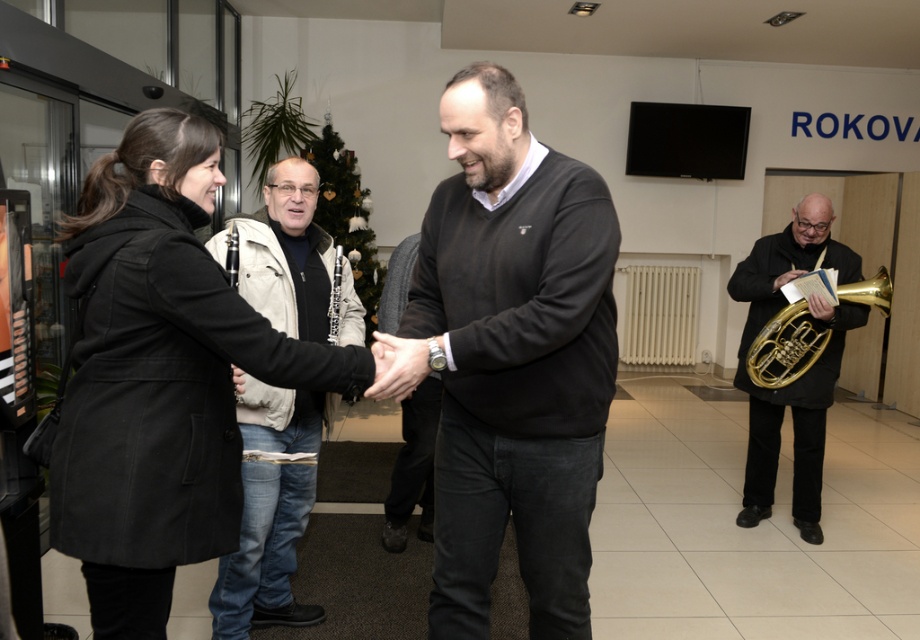
You are an interior designer assessing the layout of this music store. You notice the black matte sweater at center and the black wool coat at left. Which object would cast a longer shadow if the light source is directly above them?

The black matte sweater at center has a greater height compared to the black wool coat at left, so it would cast a longer shadow.

You are standing at the entrance of the music store and see the black wool coat at left. If you want to move towards the coat, which direction should you walk?

Since the black wool coat at left is located at point 0.589 on the x axis and 0.174 on the y axis, you should walk towards the lower left direction to reach it.

You are a photographer standing at the entrance of the music store. You want to take a photo of the light beige jacket at center and the gold brass tuba at right. The camera you have can focus on objects within a 2.5 meter range. Will both objects be in focus?

The distance between the light beige jacket at center and the gold brass tuba at right is 2.20 meters, which is within the camera focus range of 2.5 meters. Therefore, both objects will be in focus.